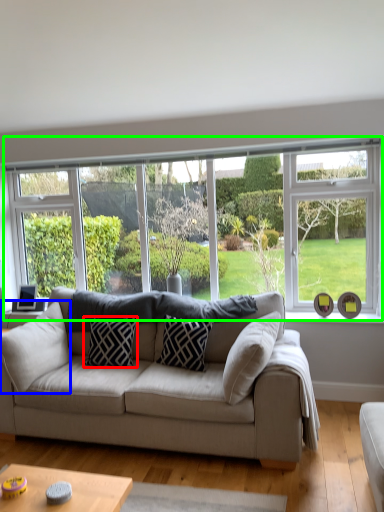
Question: Based on their relative distances, which object is farther from pillow (highlighted by a red box)? Choose from pillow (highlighted by a blue box) and window (highlighted by a green box).

Choices:
 (A) pillow
 (B) window

Answer: (B)